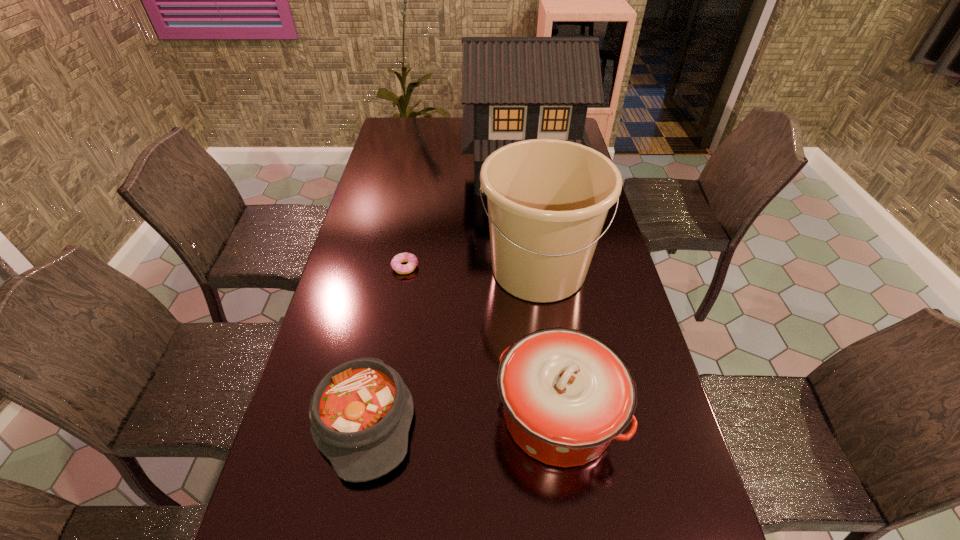
Identify the location of free region that satisfies the following two spatial constraints: 1. on the front side of the third tallest object; 2. on the left side of the doughnut. The image size is (960, 540). (379, 415).

Where is `free space that satisfies the following two spatial constraints: 1. on the front-facing side of the fourth shortest object; 2. on the right side of the dollhouse`? free space that satisfies the following two spatial constraints: 1. on the front-facing side of the fourth shortest object; 2. on the right side of the dollhouse is located at coordinates (533, 269).

Image resolution: width=960 pixels, height=540 pixels. Find the location of `vacant space that satisfies the following two spatial constraints: 1. on the front-facing side of the tallest object; 2. on the right side of the bucket`. vacant space that satisfies the following two spatial constraints: 1. on the front-facing side of the tallest object; 2. on the right side of the bucket is located at coordinates (533, 269).

Find the location of a particular element. This screenshot has height=540, width=960. free location that satisfies the following two spatial constraints: 1. on the back side of the left casserole; 2. on the right side of the taller casserole is located at coordinates (365, 415).